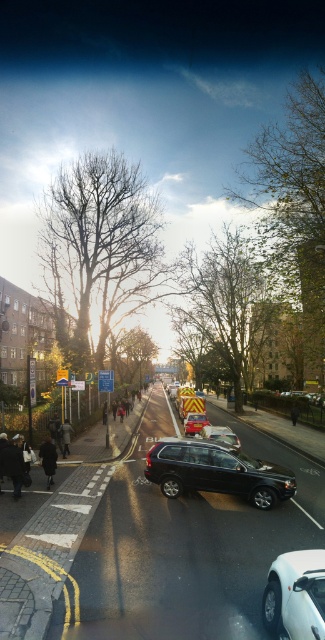
Question: Is white glossy car at lower right positioned in front of metallic silver suv at center?

Choices:
 (A) no
 (B) yes

Answer: (B)

Question: Does white glossy car at lower right appear over metallic silver suv at center?

Choices:
 (A) yes
 (B) no

Answer: (A)

Question: Based on their relative distances, which object is farther from the shiny black suv at center?

Choices:
 (A) white glossy car at lower right
 (B) metallic silver suv at center

Answer: (B)

Question: Considering the relative positions of white glossy car at lower right and metallic silver suv at center in the image provided, where is white glossy car at lower right located with respect to metallic silver suv at center?

Choices:
 (A) above
 (B) below

Answer: (A)

Question: Which of the following is the farthest from the observer?

Choices:
 (A) (311, 556)
 (B) (183, 429)
 (C) (152, 477)

Answer: (B)

Question: Which point is farther to the camera?

Choices:
 (A) shiny black suv at center
 (B) white glossy car at lower right

Answer: (A)